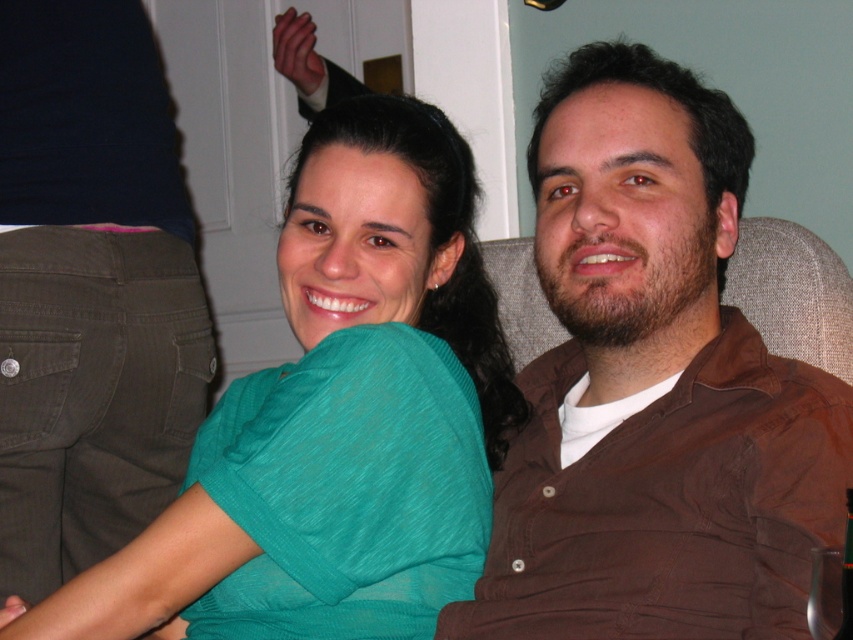
You are a tailor measuring clothes for a customer. You notice the brown cotton shirt at center and the dark green cotton pants at lower left in the image. Can the pants be worn with the shirt given their spatial positioning?

The distance between the brown cotton shirt at center and dark green cotton pants at lower left is 28.81 inches. Since clothing items are typically designed to be worn together regardless of their spatial positioning in an image, the pants can be worn with the shirt as they are separate garments meant for different parts of the body.

You are a photographer trying to focus on the brown cotton shirt at center. What are the exact coordinates where you should aim your camera?

The brown cotton shirt at center is located at coordinates 0.605 on the x axis and 0.766 on the y axis.